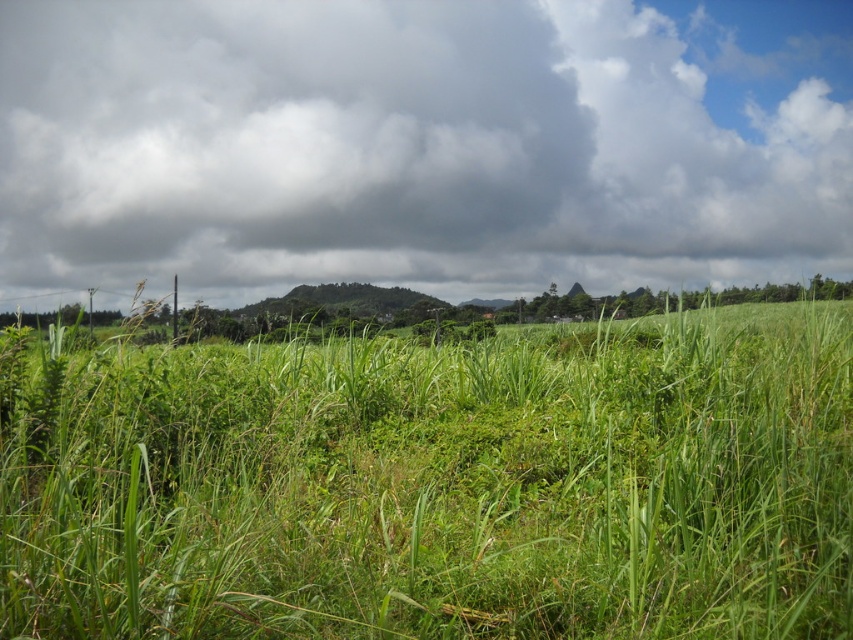
Consider the image. Is green grassy field at center taller than dark gray cloud at upper center?

Incorrect, green grassy field at center's height is not larger of dark gray cloud at upper center's.

Who is more forward, (x=438, y=563) or (x=531, y=141)?

Point (x=438, y=563) is more forward.

Describe the element at coordinates (439, 484) in the screenshot. I see `green grassy field at center` at that location.

This screenshot has width=853, height=640. I want to click on green grassy field at center, so click(x=439, y=484).